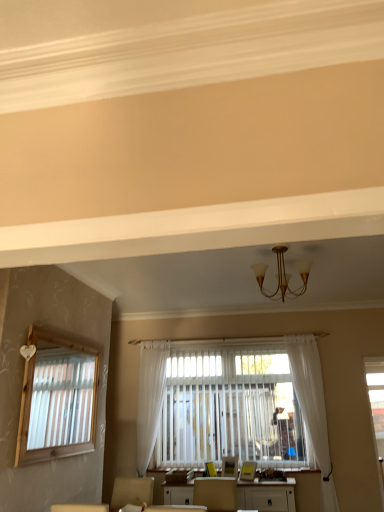
The height and width of the screenshot is (512, 384). Describe the element at coordinates (150, 398) in the screenshot. I see `white sheer curtain at center, which is the 2th curtain from right to left` at that location.

Where is `white sheer curtain at right, which ranks as the second curtain in left-to-right order`? The width and height of the screenshot is (384, 512). white sheer curtain at right, which ranks as the second curtain in left-to-right order is located at coordinates (x=312, y=410).

The image size is (384, 512). Describe the element at coordinates (312, 410) in the screenshot. I see `white sheer curtain at right, acting as the first curtain starting from the right` at that location.

Locate an element on the screen. gold metallic chandelier at center is located at coordinates click(282, 276).

The width and height of the screenshot is (384, 512). I want to click on white sheer curtain at center, marked as the 1th curtain in a left-to-right arrangement, so click(150, 398).

From the image's perspective, is white sheer curtain at right, acting as the first curtain starting from the right, beneath white glossy table at center?

No.

Which is behind, point (293, 354) or point (293, 511)?

Positioned behind is point (293, 354).

Is white sheer curtain at right, acting as the first curtain starting from the right, situated inside white glossy table at center or outside?

The correct answer is: outside.

Considering the points (284, 293) and (335, 506), which point is in front, point (284, 293) or point (335, 506)?

The point (284, 293) is closer to the camera.

Is gold metallic chandelier at center surrounding white sheer curtain at right, acting as the first curtain starting from the right?

No, white sheer curtain at right, acting as the first curtain starting from the right, is located outside of gold metallic chandelier at center.

Can you confirm if gold metallic chandelier at center is positioned to the right of white sheer curtain at right, which ranks as the second curtain in left-to-right order?

Incorrect, gold metallic chandelier at center is not on the right side of white sheer curtain at right, which ranks as the second curtain in left-to-right order.

From the image's perspective, is gold metallic chandelier at center below white sheer curtain at right, acting as the first curtain starting from the right?

Actually, gold metallic chandelier at center appears above white sheer curtain at right, acting as the first curtain starting from the right, in the image.

Considering the sizes of objects gold metallic chandelier at center and white glossy table at center in the image provided, who is wider, gold metallic chandelier at center or white glossy table at center?

white glossy table at center is wider.

Is gold metallic chandelier at center aimed at white glossy table at center?

No, gold metallic chandelier at center is not aimed at white glossy table at center.

Consider the image. Is the depth of gold metallic chandelier at center greater than that of white glossy table at center?

No.

In the scene shown: From a real-world perspective, is gold metallic chandelier at center beneath white glossy table at center?

No, from a real-world perspective, gold metallic chandelier at center is not beneath white glossy table at center.

Looking at their sizes, would you say white sheer curtain at center, marked as the 1th curtain in a left-to-right arrangement, is wider or thinner than white sheer curtain at right, which ranks as the second curtain in left-to-right order?

Clearly, white sheer curtain at center, marked as the 1th curtain in a left-to-right arrangement, has less width compared to white sheer curtain at right, which ranks as the second curtain in left-to-right order.

Could you tell me if white sheer curtain at center, marked as the 1th curtain in a left-to-right arrangement, is turned towards white sheer curtain at right, acting as the first curtain starting from the right?

No, white sheer curtain at center, marked as the 1th curtain in a left-to-right arrangement, is not facing towards white sheer curtain at right, acting as the first curtain starting from the right.

Can you confirm if white sheer curtain at center, marked as the 1th curtain in a left-to-right arrangement, is bigger than white sheer curtain at right, acting as the first curtain starting from the right?

No.

From the image's perspective, is white sheer curtain at center, marked as the 1th curtain in a left-to-right arrangement, on top of white sheer curtain at right, acting as the first curtain starting from the right?

No, from the image's perspective, white sheer curtain at center, marked as the 1th curtain in a left-to-right arrangement, is not above white sheer curtain at right, acting as the first curtain starting from the right.

Does white glossy table at center contain white sheer curtain at right, which ranks as the second curtain in left-to-right order?

No, white sheer curtain at right, which ranks as the second curtain in left-to-right order, is located outside of white glossy table at center.

Which of these two, white glossy table at center or white sheer curtain at right, acting as the first curtain starting from the right, stands taller?

Standing taller between the two is white sheer curtain at right, acting as the first curtain starting from the right.

Is white glossy table at center closer to camera compared to white sheer curtain at right, acting as the first curtain starting from the right?

Yes, it is.

From the image's perspective, which curtain is the 2nd one above the white glossy table at center? Please provide its 2D coordinates.

[(312, 410)]

Looking at this image, does white sheer curtain at center, marked as the 1th curtain in a left-to-right arrangement, touch gold metallic chandelier at center?

There is a gap between white sheer curtain at center, marked as the 1th curtain in a left-to-right arrangement, and gold metallic chandelier at center.

From the image's perspective, between white sheer curtain at center, marked as the 1th curtain in a left-to-right arrangement, and gold metallic chandelier at center, who is located below?

white sheer curtain at center, marked as the 1th curtain in a left-to-right arrangement, appears lower in the image.

Looking at their sizes, would you say white sheer curtain at center, marked as the 1th curtain in a left-to-right arrangement, is wider or thinner than gold metallic chandelier at center?

In the image, white sheer curtain at center, marked as the 1th curtain in a left-to-right arrangement, appears to be more narrow than gold metallic chandelier at center.

Which object is positioned more to the right, white sheer curtain at center, marked as the 1th curtain in a left-to-right arrangement, or gold metallic chandelier at center?

From the viewer's perspective, gold metallic chandelier at center appears more on the right side.

Could you tell me if white sheer curtain at center, marked as the 1th curtain in a left-to-right arrangement, is turned towards white glossy table at center?

No, white sheer curtain at center, marked as the 1th curtain in a left-to-right arrangement, is not facing towards white glossy table at center.

Which of these two, white sheer curtain at center, which is the 2th curtain from right to left, or white glossy table at center, stands shorter?

white glossy table at center is shorter.

In the scene shown: Which is farther from the camera, (139, 383) or (254, 488)?

Point (139, 383)

From a real-world perspective, which curtain is the 1st one above the white glossy table at center? Please provide its 2D coordinates.

[(312, 410)]

From a real-world perspective, count 2nd curtains downward from the gold metallic chandelier at center and point to it. Please provide its 2D coordinates.

[(312, 410)]

Which object lies further to the anchor point white sheer curtain at center, marked as the 1th curtain in a left-to-right arrangement, white glossy table at center or gold metallic chandelier at center?

gold metallic chandelier at center is positioned further to the anchor white sheer curtain at center, marked as the 1th curtain in a left-to-right arrangement.

Looking at the image, which one is located closer to gold metallic chandelier at center, white sheer curtain at right, acting as the first curtain starting from the right, or white glossy table at center?

white sheer curtain at right, acting as the first curtain starting from the right, is closer to gold metallic chandelier at center.

Which object lies further to the anchor point white sheer curtain at right, acting as the first curtain starting from the right, white glossy table at center or gold metallic chandelier at center?

The object further to white sheer curtain at right, acting as the first curtain starting from the right, is gold metallic chandelier at center.

When comparing their distances from white glossy table at center, does white sheer curtain at right, which ranks as the second curtain in left-to-right order, or gold metallic chandelier at center seem further?

Among the two, gold metallic chandelier at center is located further to white glossy table at center.

Which object lies further to the anchor point gold metallic chandelier at center, white glossy table at center or white sheer curtain at right, acting as the first curtain starting from the right?

Based on the image, white glossy table at center appears to be further to gold metallic chandelier at center.

Estimate the real-world distances between objects in this image. Which object is further from white sheer curtain at center, marked as the 1th curtain in a left-to-right arrangement, white glossy table at center or white sheer curtain at right, which ranks as the second curtain in left-to-right order?

white sheer curtain at right, which ranks as the second curtain in left-to-right order.

Based on their spatial positions, is gold metallic chandelier at center or white sheer curtain at right, acting as the first curtain starting from the right, closer to white glossy table at center?

white sheer curtain at right, acting as the first curtain starting from the right, is closer to white glossy table at center.

When comparing their distances from white sheer curtain at center, which is the 2th curtain from right to left, does white sheer curtain at right, which ranks as the second curtain in left-to-right order, or gold metallic chandelier at center seem further?

gold metallic chandelier at center.

The width and height of the screenshot is (384, 512). In order to click on table between white sheer curtain at center, marked as the 1th curtain in a left-to-right arrangement, and white sheer curtain at right, acting as the first curtain starting from the right, from left to right in this screenshot , I will do `click(267, 495)`.

Identify the location of curtain between gold metallic chandelier at center and white sheer curtain at center, which is the 2th curtain from right to left, vertically. click(312, 410).